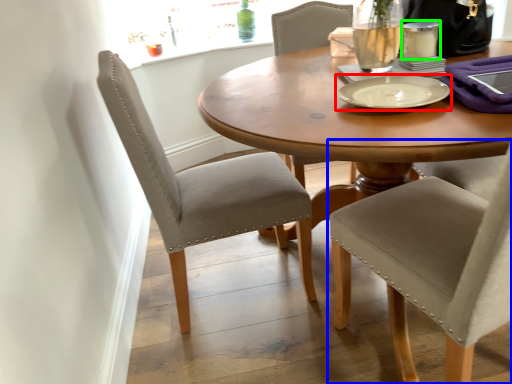
Question: Which object is positioned closest to tableware (highlighted by a red box)? Select from chair (highlighted by a blue box) and tableware (highlighted by a green box).

Choices:
 (A) chair
 (B) tableware

Answer: (B)